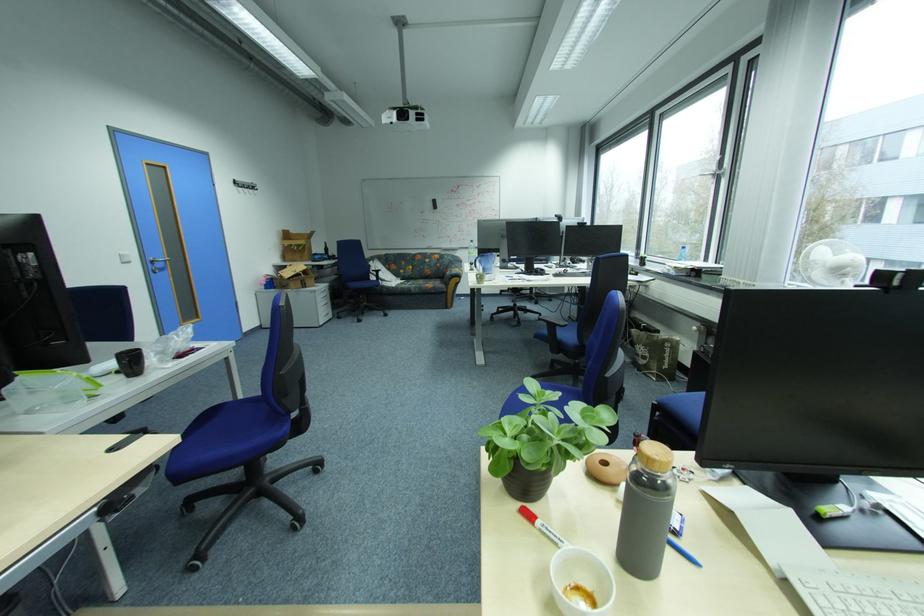
Describe the element at coordinates (580, 582) in the screenshot. I see `the small white cup` at that location.